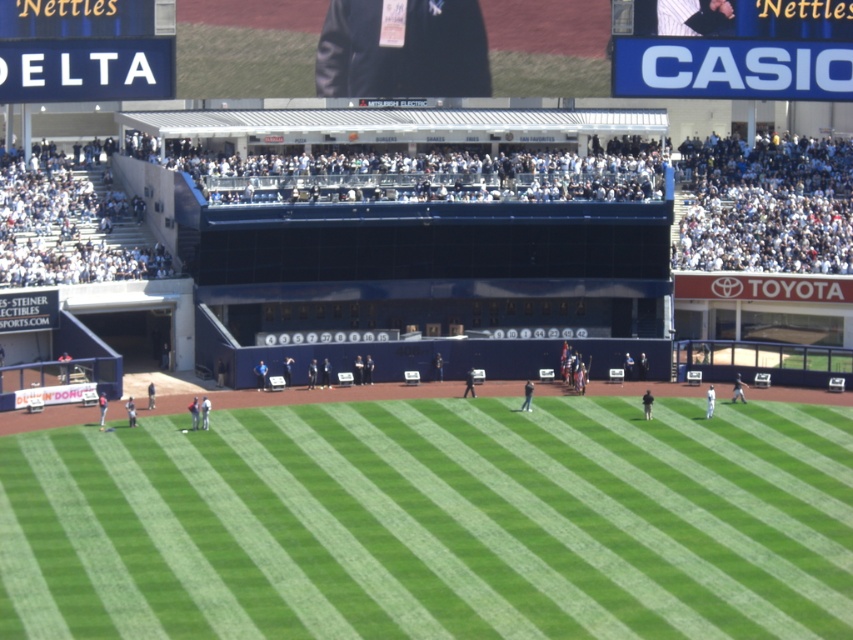
This screenshot has height=640, width=853. What do you see at coordinates (434, 524) in the screenshot?
I see `green grass at center` at bounding box center [434, 524].

From the picture: Does green grass at center have a greater width compared to blue plastic sign at upper left?

Indeed, green grass at center has a greater width compared to blue plastic sign at upper left.

Locate an element on the screen. The height and width of the screenshot is (640, 853). green grass at center is located at coordinates (434, 524).

Which is in front, point (724, 51) or point (94, 38)?

Point (94, 38) is in front.

In the scene shown: Does blue plastic sign at upper center lie in front of blue plastic sign at upper left?

No, it is behind blue plastic sign at upper left.

The image size is (853, 640). I want to click on blue plastic sign at upper center, so click(x=732, y=49).

Does green grass at center have a greater width compared to blue plastic sign at upper center?

Yes, green grass at center is wider than blue plastic sign at upper center.

Can you confirm if green grass at center is shorter than blue plastic sign at upper center?

Indeed, green grass at center has a lesser height compared to blue plastic sign at upper center.

I want to click on green grass at center, so click(434, 524).

Find the location of `green grass at center`. green grass at center is located at coordinates (434, 524).